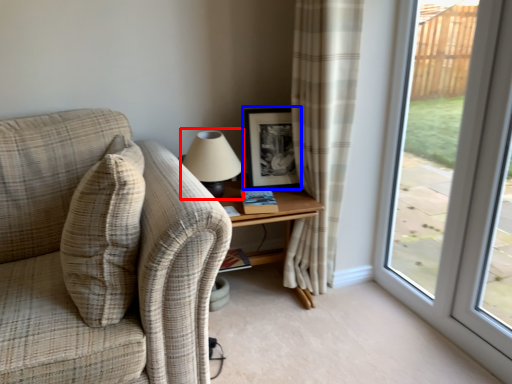
Question: Which object appears closest to the camera in this image, table lamp (highlighted by a red box) or picture frame (highlighted by a blue box)?

Choices:
 (A) table lamp
 (B) picture frame

Answer: (A)